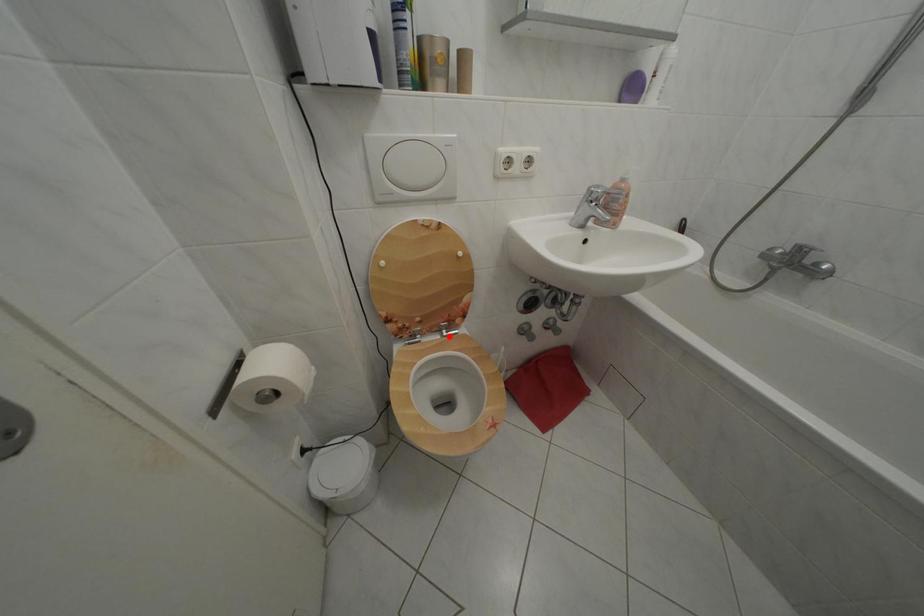
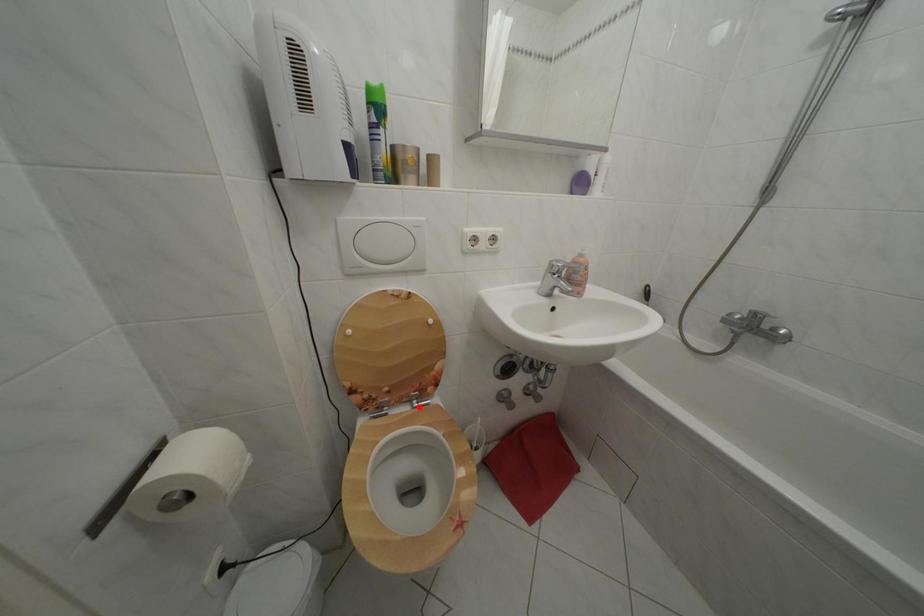
I am providing you with two images of the same scene from different viewpoints. A red point is marked on the first image and another point is marked on the second image. Does the point marked in image1 correspond to the same location as the one in image2?

Yes